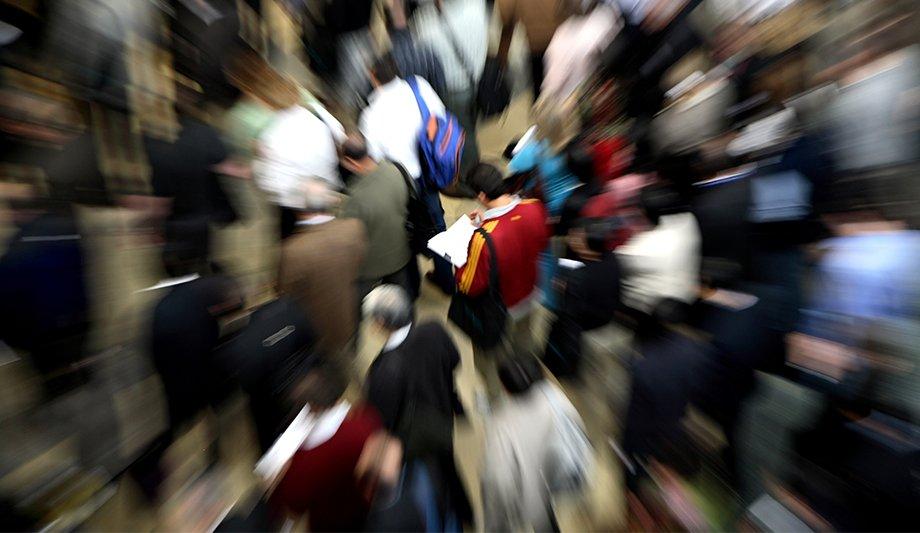
The image size is (920, 533). What are the coordinates of `open book` in the screenshot? It's located at (454, 241).